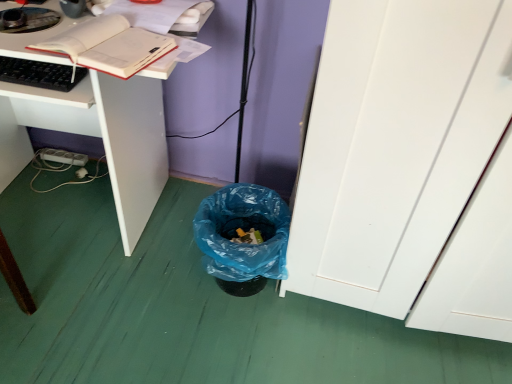
Locate an element on the screen. This screenshot has width=512, height=384. free spot to the right of blue plastic trash can at lower center is located at coordinates (313, 321).